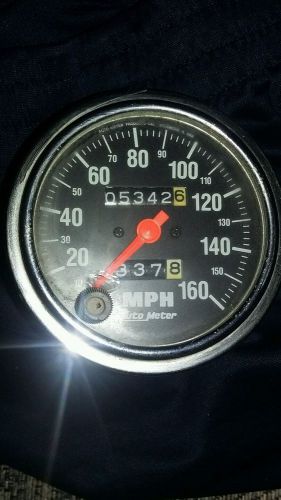
Find the location of `screws`. screws is located at coordinates (119, 233), (178, 234).